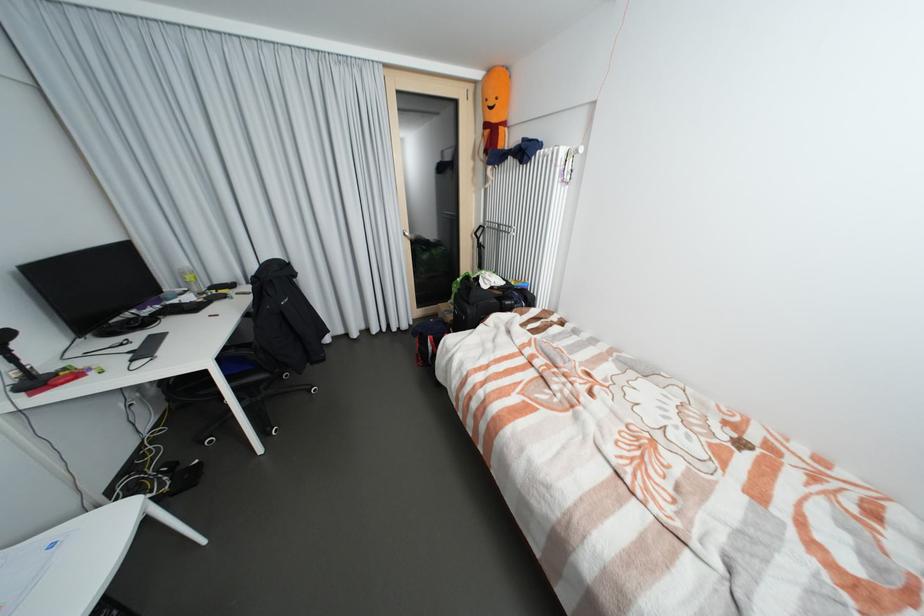
The width and height of the screenshot is (924, 616). What are the coordinates of `silver door handle` in the screenshot? It's located at (416, 238).